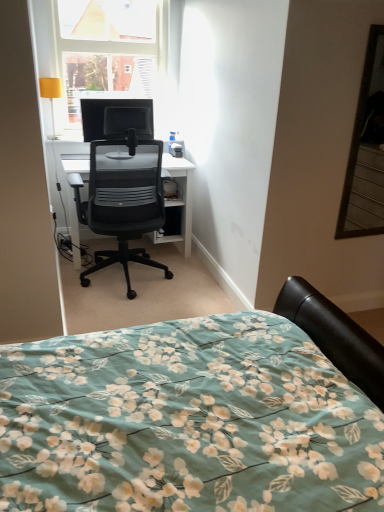
Question: From the image's perspective, relative to matte black monitor at upper center, is transparent glass window at upper left above or below?

Choices:
 (A) above
 (B) below

Answer: (A)

Question: Is point (72, 113) closer or farther from the camera than point (89, 132)?

Choices:
 (A) closer
 (B) farther

Answer: (B)

Question: Estimate the real-world distances between objects in this image. Which object is farther from the black mesh chair at center?

Choices:
 (A) matte black monitor at upper center
 (B) transparent glass window at upper left
 (C) floral fabric bed at lower left
 (D) yellow fabric lampshade at upper left

Answer: (C)

Question: Based on their relative distances, which object is nearer to the yellow fabric lampshade at upper left?

Choices:
 (A) transparent glass window at upper left
 (B) black mesh chair at center
 (C) matte black monitor at upper center
 (D) floral fabric bed at lower left

Answer: (C)